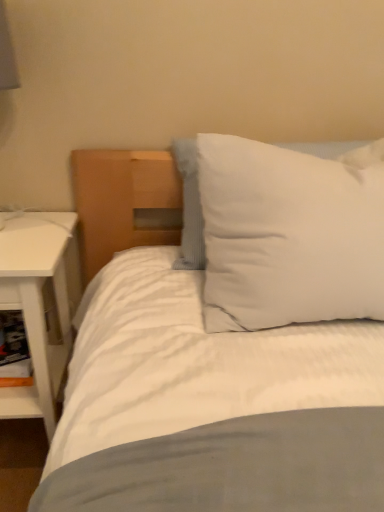
Where is `white soft pillow at upper right`? This screenshot has height=512, width=384. white soft pillow at upper right is located at coordinates (288, 236).

Considering the relative sizes of white soft pillow at upper right and white matte nightstand at left in the image provided, is white soft pillow at upper right smaller than white matte nightstand at left?

Yes, white soft pillow at upper right is smaller than white matte nightstand at left.

Is white soft pillow at upper right far away from white matte nightstand at left?

white soft pillow at upper right is actually quite close to white matte nightstand at left.

Can you confirm if white soft pillow at upper right is wider than white matte nightstand at left?

No, white soft pillow at upper right is not wider than white matte nightstand at left.

Does point (364, 173) come closer to viewer compared to point (46, 254)?

Yes, it is.

Is white cardboard shelf at lower left aimed at white matte nightstand at left?

Yes, white cardboard shelf at lower left faces towards white matte nightstand at left.

Image resolution: width=384 pixels, height=512 pixels. I want to click on nightstand above the white cardboard shelf at lower left (from the image's perspective), so click(x=40, y=304).

Does white cardboard shelf at lower left have a greater height compared to white matte nightstand at left?

No, white cardboard shelf at lower left is not taller than white matte nightstand at left.

Who is more distant, white cardboard shelf at lower left or white matte nightstand at left?

white cardboard shelf at lower left is further away from the camera.

Is the depth of white soft pillow at upper right less than that of white cardboard shelf at lower left?

Yes, it is in front of white cardboard shelf at lower left.

Does white soft pillow at upper right have a greater height compared to white cardboard shelf at lower left?

Yes.

From the picture: Considering the sizes of objects white soft pillow at upper right and white cardboard shelf at lower left in the image provided, who is bigger, white soft pillow at upper right or white cardboard shelf at lower left?

white soft pillow at upper right.

How many degrees apart are the facing directions of white soft pillow at upper right and white cardboard shelf at lower left?

0.118 degrees.

Considering the sizes of white matte nightstand at left and white cardboard shelf at lower left in the image, is white matte nightstand at left wider or thinner than white cardboard shelf at lower left?

Clearly, white matte nightstand at left has more width compared to white cardboard shelf at lower left.

Looking at this image, from the image's perspective, which object appears higher, white matte nightstand at left or white cardboard shelf at lower left?

From the image's view, white matte nightstand at left is above.

Considering the relative sizes of white matte nightstand at left and white cardboard shelf at lower left in the image provided, is white matte nightstand at left smaller than white cardboard shelf at lower left?

No.

From a real-world perspective, is white matte nightstand at left physically located above or below white cardboard shelf at lower left?

white matte nightstand at left is situated higher than white cardboard shelf at lower left in the real world.

Does white cardboard shelf at lower left have a larger size compared to white soft pillow at upper right?

Incorrect, white cardboard shelf at lower left is not larger than white soft pillow at upper right.

Measure the distance between white cardboard shelf at lower left and white soft pillow at upper right.

78.58 centimeters.

From the image's perspective, which one is positioned lower, white cardboard shelf at lower left or white soft pillow at upper right?

white cardboard shelf at lower left is shown below in the image.

Is white cardboard shelf at lower left oriented away from white soft pillow at upper right?

white cardboard shelf at lower left is not turned away from white soft pillow at upper right.

Where is `pillow above the white matte nightstand at left (from a real-world perspective)`? pillow above the white matte nightstand at left (from a real-world perspective) is located at coordinates (288, 236).

From the image's perspective, is white matte nightstand at left located above or below white soft pillow at upper right?

Clearly, from the image's perspective, white matte nightstand at left is below white soft pillow at upper right.

Based on the photo, is white matte nightstand at left inside the boundaries of white soft pillow at upper right, or outside?

white matte nightstand at left is not inside white soft pillow at upper right, it's outside.

From a real-world perspective, is white matte nightstand at left physically above white soft pillow at upper right?

Incorrect, from a real-world perspective, white matte nightstand at left is lower than white soft pillow at upper right.

Find the location of a particular element. pillow in front of the white matte nightstand at left is located at coordinates (x=288, y=236).

Identify the location of nightstand above the white cardboard shelf at lower left (from a real-world perspective). (40, 304).

Considering their positions, is white matte nightstand at left positioned further to white cardboard shelf at lower left than white soft pillow at upper right?

Among the two, white soft pillow at upper right is located further to white cardboard shelf at lower left.

Looking at the image, which one is located further to white matte nightstand at left, white soft pillow at upper right or white cardboard shelf at lower left?

white soft pillow at upper right is positioned further to the anchor white matte nightstand at left.

Which object lies nearer to the anchor point white soft pillow at upper right, white cardboard shelf at lower left or white matte nightstand at left?

Among the two, white matte nightstand at left is located nearer to white soft pillow at upper right.

Considering their positions, is white matte nightstand at left positioned closer to white soft pillow at upper right than white cardboard shelf at lower left?

Among the two, white matte nightstand at left is located nearer to white soft pillow at upper right.

Estimate the real-world distances between objects in this image. Which object is further from white matte nightstand at left, white cardboard shelf at lower left or white soft pillow at upper right?

white soft pillow at upper right is positioned further to the anchor white matte nightstand at left.

From the image, which object appears to be farther from white cardboard shelf at lower left, white soft pillow at upper right or white matte nightstand at left?

Based on the image, white soft pillow at upper right appears to be further to white cardboard shelf at lower left.

Where is `nightstand between white cardboard shelf at lower left and white soft pillow at upper right in the horizontal direction`? The height and width of the screenshot is (512, 384). nightstand between white cardboard shelf at lower left and white soft pillow at upper right in the horizontal direction is located at coordinates pyautogui.click(x=40, y=304).